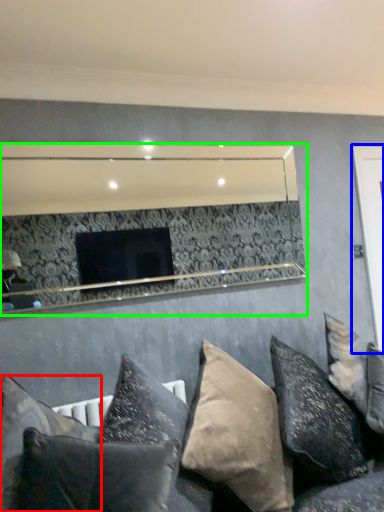
Question: Which is farther away from pillow (highlighted by a red box)? glass door (highlighted by a blue box) or mirror (highlighted by a green box)?

Choices:
 (A) glass door
 (B) mirror

Answer: (B)